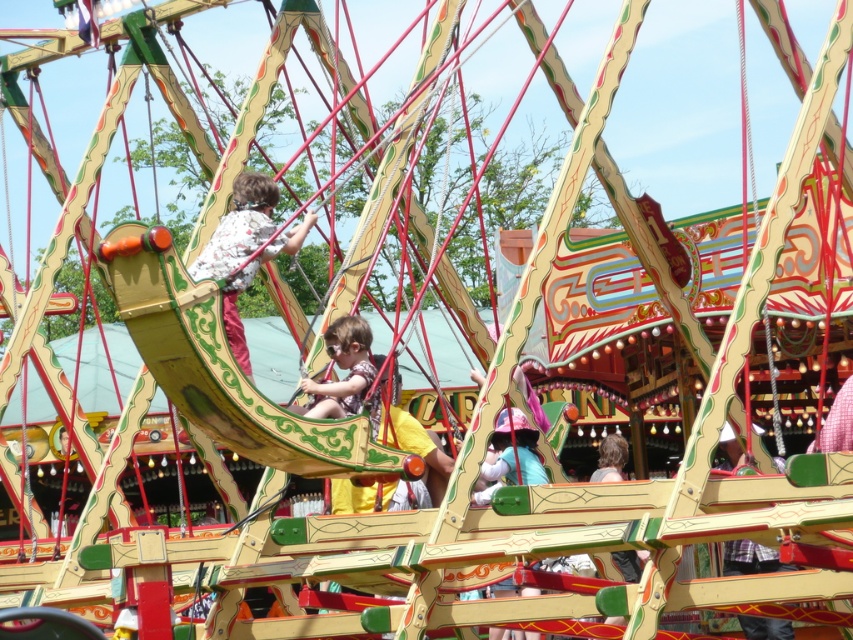
Consider the image. You are standing at the center of the carousel and want to find the floral shirt fabric at center. Based on the coordinates provided, in which direction should you look to locate it?

The floral shirt fabric at center is located at coordinates point (238, 227), so you should look to the lower left direction from the center to locate it.

You are a photographer trying to capture a clear shot of the floral shirt fabric at center and the matte yellow swing at center. Since the carousel is moving, you need to know which object is taller to adjust your camera angle. Which one is taller?

The floral shirt fabric at center is taller than the matte yellow swing at center, so you should adjust your camera angle to account for its height.

You are a photographer at the fairground and want to capture a photo of the floral shirt fabric at center and the matte yellow swing at center. Which object should you focus on if you want to highlight the larger one in your shot?

The floral shirt fabric at center is larger in size than the matte yellow swing at center, so you should focus on the floral shirt fabric at center to highlight the larger object.